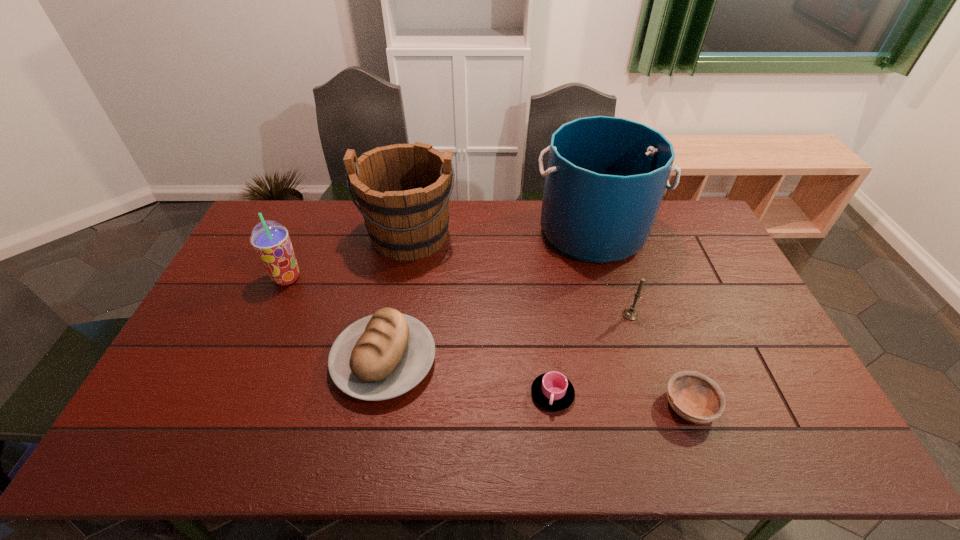
Find the location of `bucket`. bucket is located at coordinates (606, 176).

Locate an element on the screen. The image size is (960, 540). wine bucket is located at coordinates (403, 190).

You are a GUI agent. You are given a task and a screenshot of the screen. Output one action in this format:
    pyautogui.click(x=<x>, y=<y>)
    Task: Click on the smoothie
    This screenshot has height=540, width=960.
    Given the screenshot: What is the action you would take?
    pyautogui.click(x=271, y=241)

Find the location of a particular element. the fifth shortest object is located at coordinates (271, 241).

The width and height of the screenshot is (960, 540). What are the coordinates of `candle` in the screenshot? It's located at (630, 313).

Where is `bread`? The width and height of the screenshot is (960, 540). bread is located at coordinates click(381, 356).

Find the location of a particular element. cup is located at coordinates (552, 391).

Where is `bowl`? This screenshot has height=540, width=960. bowl is located at coordinates (695, 397).

At what (x,y) coordinates should I click in order to perform the action: click on free space located on the right of the bucket. Please return your answer as a coordinate pair (x, y). The height and width of the screenshot is (540, 960). Looking at the image, I should click on 690,232.

Find the location of a particular element. free region located 0.370m on the side of the wine bucket with the handle for carrying is located at coordinates (389, 359).